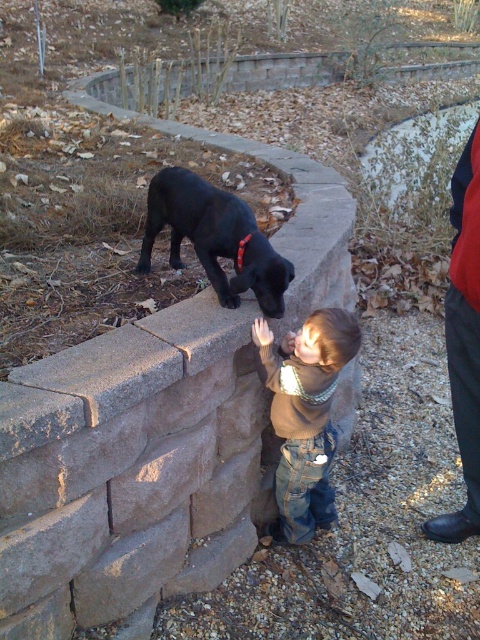
Can you confirm if black matte dog at upper center is wider than red fabric pants at right?

Correct, the width of black matte dog at upper center exceeds that of red fabric pants at right.

Which of these two, black matte dog at upper center or red fabric pants at right, stands taller?

red fabric pants at right is taller.

Between point (153, 177) and point (458, 301), which one is positioned behind?

The point (153, 177) is behind.

You are a GUI agent. You are given a task and a screenshot of the screen. Output one action in this format:
    pyautogui.click(x=<x>, y=<y>)
    Task: Click on the black matte dog at upper center
    
    Given the screenshot: What is the action you would take?
    pyautogui.click(x=215, y=237)

Is point (333, 365) behind point (462, 419)?

No, it is not.

Does brown fuzzy sweater at center lie in front of red fabric pants at right?

No, it is not.

Where is `brown fuzzy sweater at center`? brown fuzzy sweater at center is located at coordinates (304, 416).

Between brown fuzzy sweater at center and black matte dog at upper center, which one is positioned lower?

brown fuzzy sweater at center

Does point (295, 428) lie in front of point (244, 205)?

Yes, it is in front of point (244, 205).

Is point (347, 333) behind point (194, 220)?

No, it is in front of (194, 220).

Locate an element on the screen. brown fuzzy sweater at center is located at coordinates (304, 416).